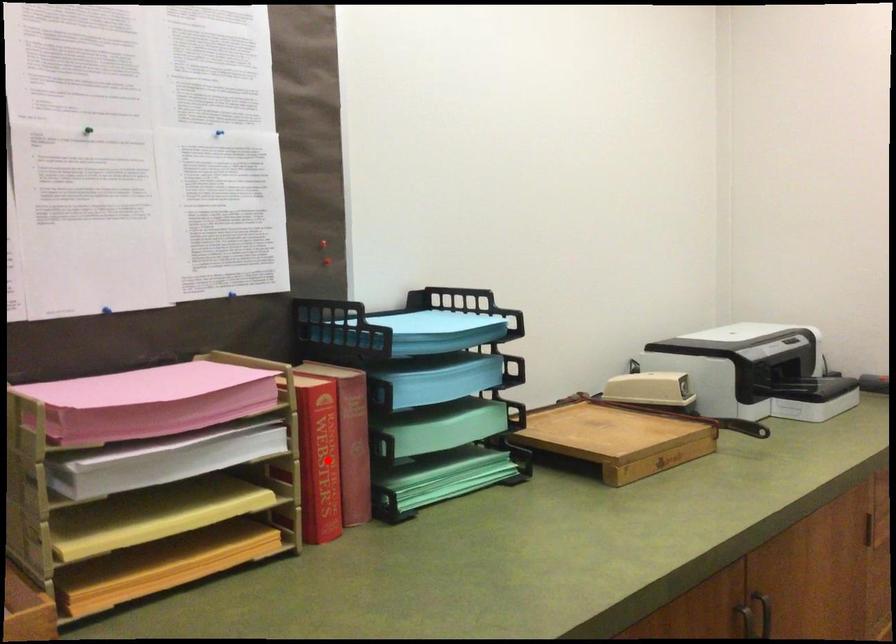
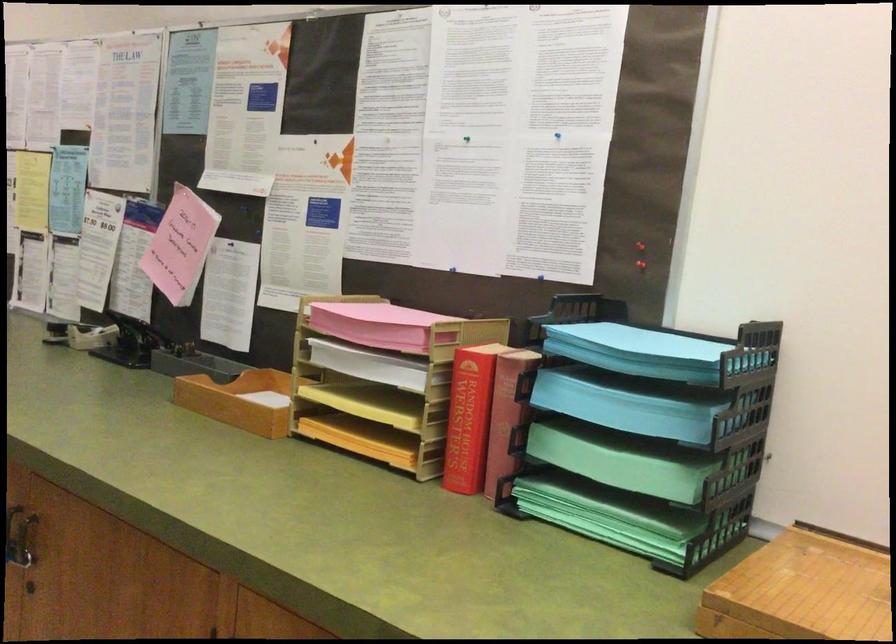
Find the pixel in the second image that matches the highlighted location in the first image.

(469, 418)